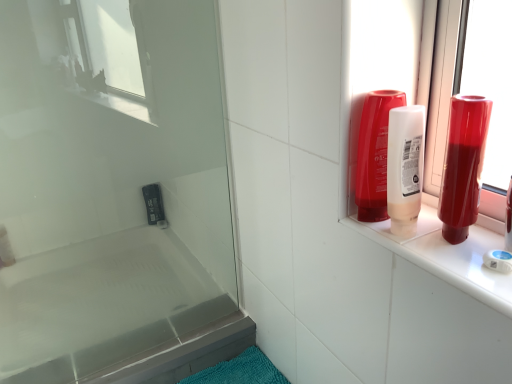
Image resolution: width=512 pixels, height=384 pixels. Identify the location of free space behind transparent glass screen door at upper left. (162, 325).